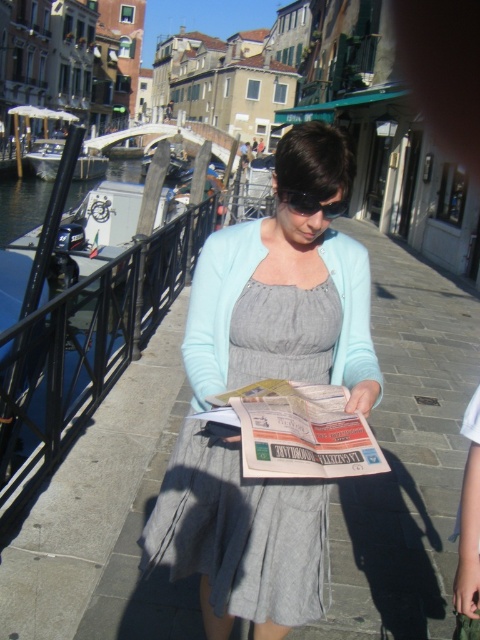
Is gray concrete pavement at center behind gray cotton dress at center?

That is True.

Find the location of a particular element. This screenshot has width=480, height=640. gray concrete pavement at center is located at coordinates (405, 456).

Between point (173, 426) and point (165, 502), which one is positioned behind?

The point (173, 426) is behind.

The width and height of the screenshot is (480, 640). I want to click on gray concrete pavement at center, so click(x=405, y=456).

How far apart are gray cotton dress at center and black plastic sunglasses at center?

The distance of gray cotton dress at center from black plastic sunglasses at center is 1.14 meters.

Which of these two, gray cotton dress at center or black plastic sunglasses at center, stands shorter?

With less height is black plastic sunglasses at center.

You are a GUI agent. You are given a task and a screenshot of the screen. Output one action in this format:
    pyautogui.click(x=<x>, y=<y>)
    Task: Click on the gray cotton dress at center
    The width and height of the screenshot is (480, 640).
    Given the screenshot: What is the action you would take?
    pyautogui.click(x=286, y=288)

Which is in front, point (67, 552) or point (299, 196)?

Point (299, 196) is in front.

Is gray concrete pavement at center below black plastic sunglasses at center?

Indeed, gray concrete pavement at center is positioned under black plastic sunglasses at center.

Does point (396, 547) come farther from viewer compared to point (307, 204)?

Yes, it is.

Find the location of a particular element. gray concrete pavement at center is located at coordinates (405, 456).